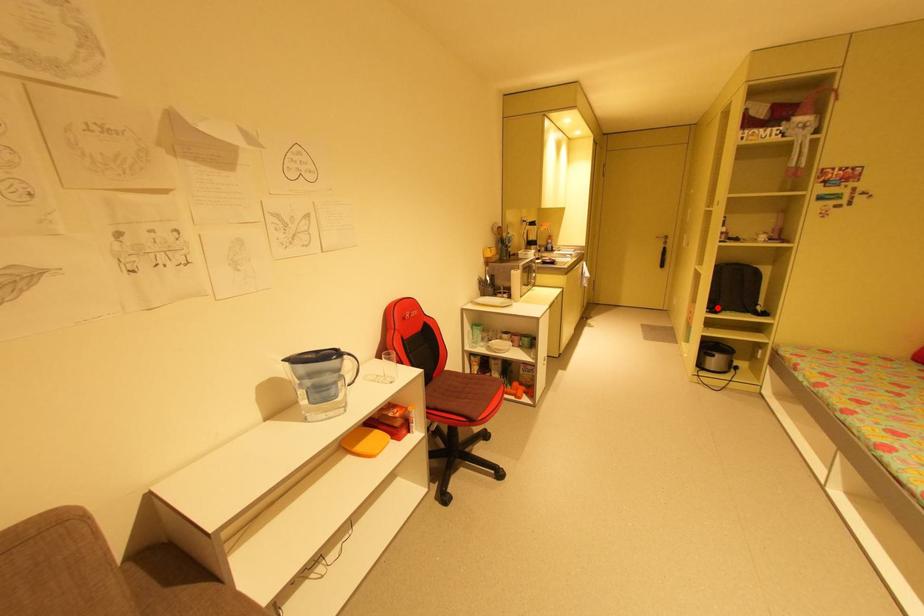
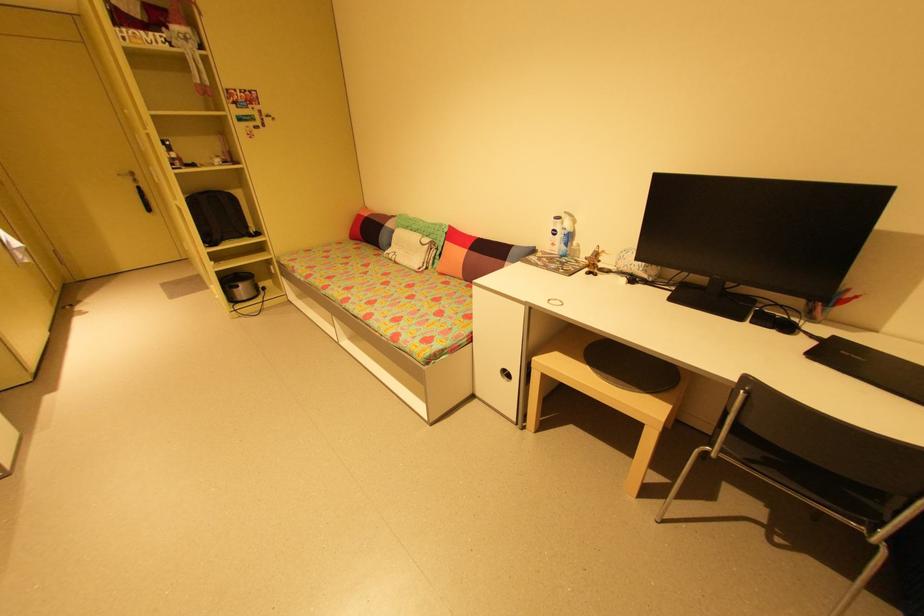
The point at the highlighted location is marked in the first image. Where is the corresponding point in the second image?

(215, 241)